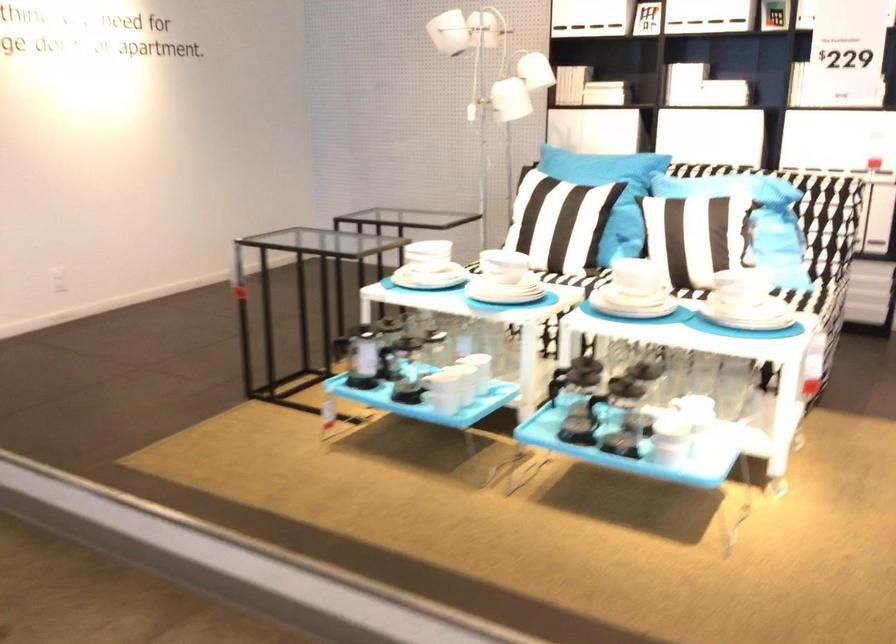
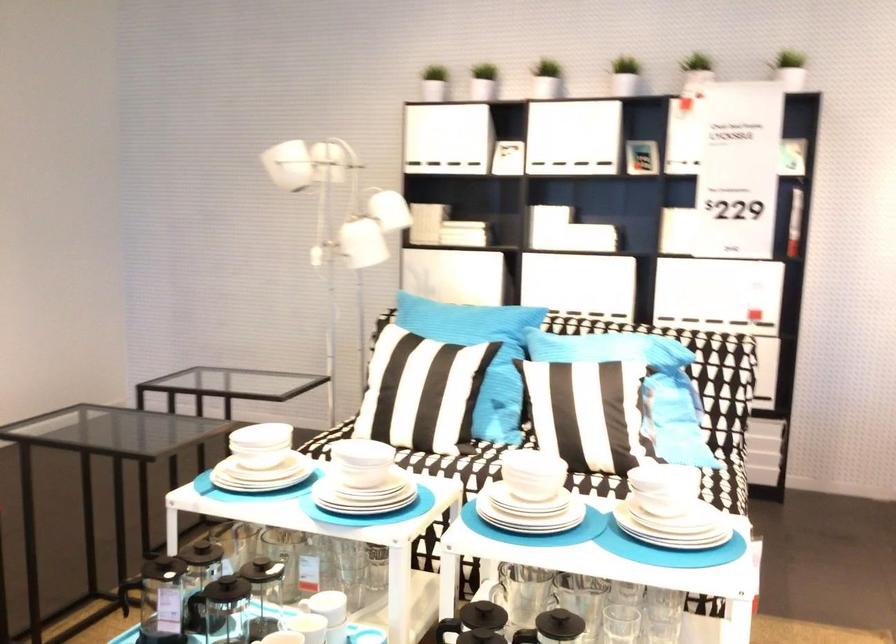
Where in the second image is the point corresponding to pixel 460 377 from the first image?

(304, 629)